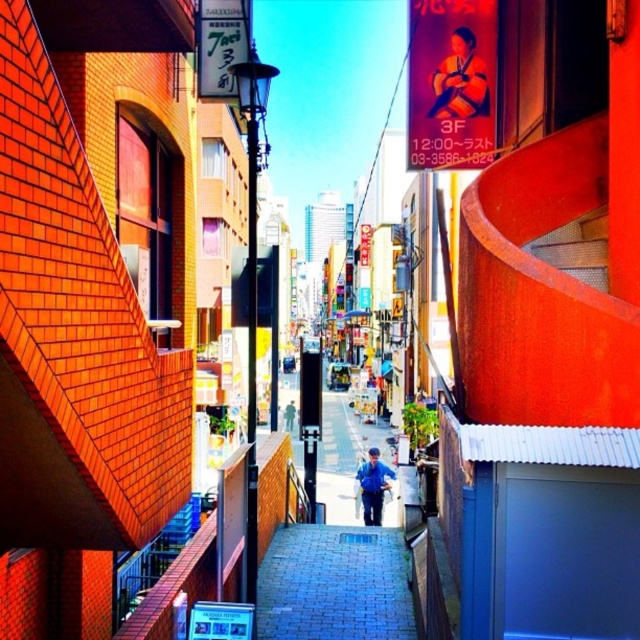
You are a delivery person carrying a box that is 10 cm tall. You need to place it on either the blue brick pavement at center or the silky kimono at center. Based on their heights, which surface can safely accommodate the box without it toppling over?

The blue brick pavement at center has a lesser height compared to the silky kimono at center. Since the box is 10 cm tall, placing it on the lower blue brick pavement at center would be safer to prevent toppling.

You are standing in the alleyway and want to determine which of the two points, point [449,60] or point [380,476], is nearer to you. Based on the scene, which one is closer?

Point [449,60] is closer to the viewer than point [380,476].

You are a customer in a traditional Japanese store and see both the silky kimono at center and the blue fabric jacket at center displayed in the store. Which item is closer to you?

The silky kimono at center is closer to you because it is in front of the blue fabric jacket at center.